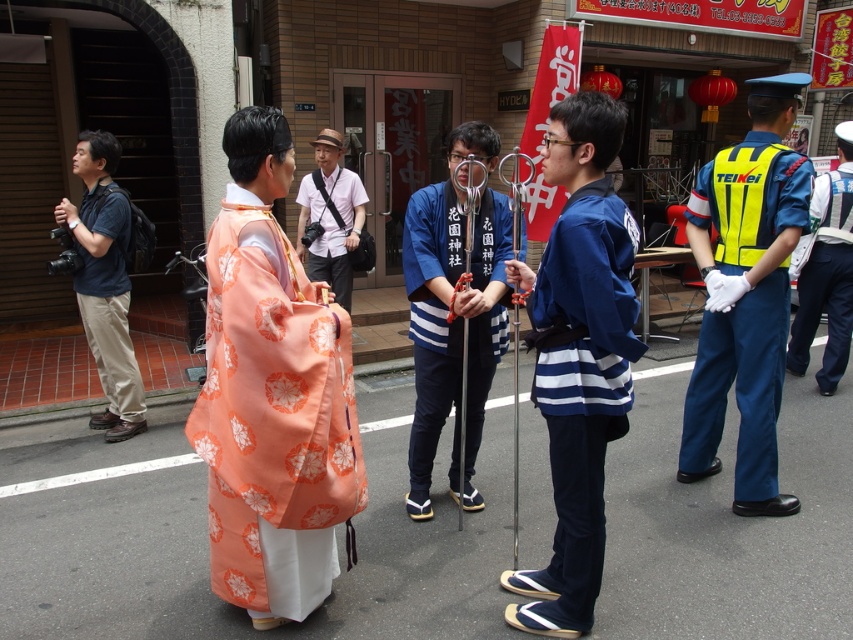
Question: Which point is farther to the camera?

Choices:
 (A) blue cotton kimono at center
 (B) silky peach kimono at center

Answer: (A)

Question: Does blue fabric kimono at center appear over light brown leather hat at center?

Choices:
 (A) no
 (B) yes

Answer: (A)

Question: Among these points, which one is farthest from the camera?

Choices:
 (A) (692, 458)
 (B) (267, 422)
 (C) (299, 253)

Answer: (C)

Question: Estimate the real-world distances between objects in this image. Which object is farther from the blue cotton kimono at center?

Choices:
 (A) light brown leather hat at center
 (B) dark blue shirt at left

Answer: (A)

Question: Can you confirm if silky peach kimono at center is positioned below high-visibility reflective vest at right?

Choices:
 (A) yes
 (B) no

Answer: (A)

Question: Can you confirm if dark blue shirt at left is positioned to the right of light brown leather hat at center?

Choices:
 (A) no
 (B) yes

Answer: (A)